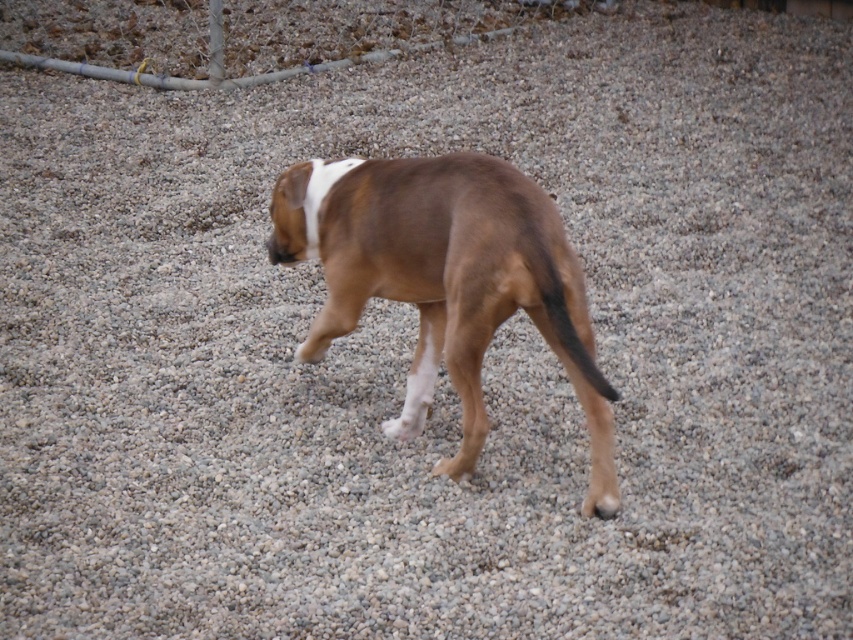
You are a dog owner observing your brown matte dog at center and its brown matte tail at center in a gravel yard. Which part of your dog is taller?

The brown matte dog at center is much taller than the brown matte tail at center.

You are a photographer trying to capture the brown matte dog at center and its brown matte tail at center in a single shot. Since the tail is positioned behind the dog, will the tail be visible in the photo if you focus on the dog?

The brown matte tail at center is behind the brown matte dog at center, so if you focus on the dog, the tail may still be visible depending on the depth of field of the camera. However, since the tail is part of the dog, it should naturally be included in the photo as long as the camera captures the entire dog.

You are a photographer trying to capture the brown matte dog at center and its brown matte tail at center in a clear photo. Since the dog is moving, you need to focus on the part that is closer to you. Which part should you focus on?

The brown matte dog at center is positioned over brown matte tail at center, so you should focus on the brown matte dog at center since it is closer to you.